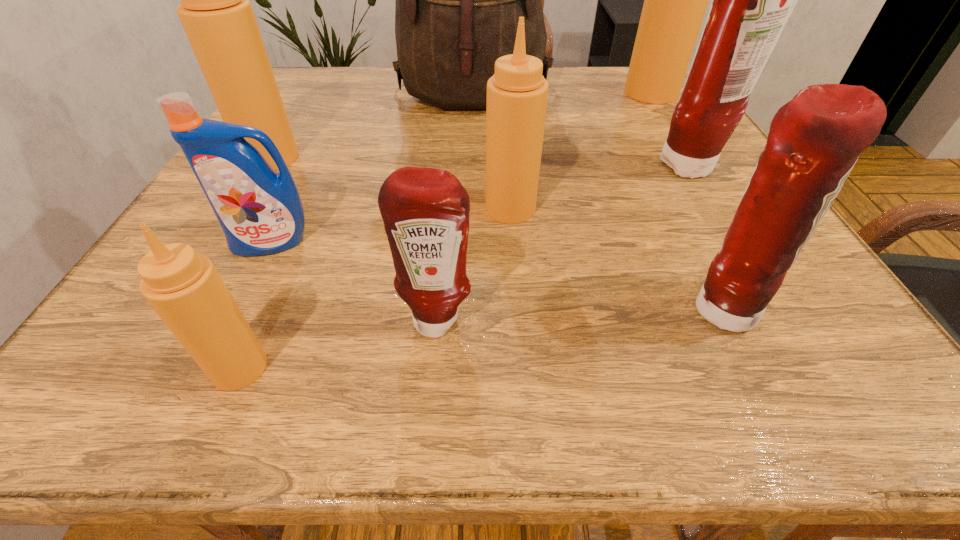
Locate an element on the screen. The height and width of the screenshot is (540, 960). vacant area situated 0.210m on the label of the detergent is located at coordinates (206, 377).

Find the location of a particular element. free point located on the left of the fifth condiment from right to left is located at coordinates (282, 319).

Where is `vacant area situated on the left of the sixth condiment from right to left`? The width and height of the screenshot is (960, 540). vacant area situated on the left of the sixth condiment from right to left is located at coordinates (140, 368).

Locate an element on the screen. backpack located at the far edge is located at coordinates (458, 0).

Locate an element on the screen. condiment that is at the far edge is located at coordinates (675, 0).

Where is `detergent that is at the left edge`? The image size is (960, 540). detergent that is at the left edge is located at coordinates (260, 211).

This screenshot has height=540, width=960. What are the coordinates of `object located at the near left corner` in the screenshot? It's located at (184, 288).

You are a GUI agent. You are given a task and a screenshot of the screen. Output one action in this format:
    pyautogui.click(x=<x>, y=<y>)
    Task: Click on the object that is at the far right corner
    Image resolution: width=960 pixels, height=540 pixels.
    Given the screenshot: What is the action you would take?
    pyautogui.click(x=675, y=0)

The height and width of the screenshot is (540, 960). Find the location of `object that is at the near right corner`. object that is at the near right corner is located at coordinates (814, 141).

In the image, there is a desktop. At what (x,y) coordinates should I click in order to perform the action: click on vacant space at the near edge. Please return your answer as a coordinate pair (x, y). This screenshot has width=960, height=540. Looking at the image, I should click on (393, 382).